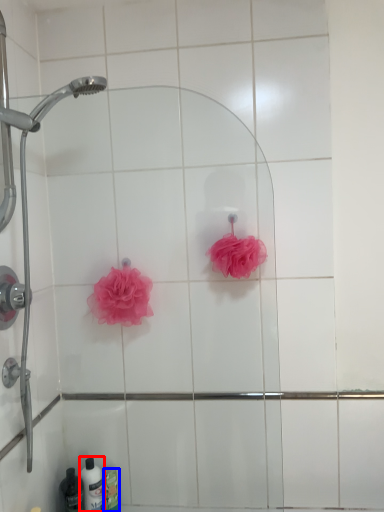
Question: Which object appears closest to the camera in this image, toiletry (highlighted by a red box) or toiletry (highlighted by a blue box)?

Choices:
 (A) toiletry
 (B) toiletry

Answer: (A)